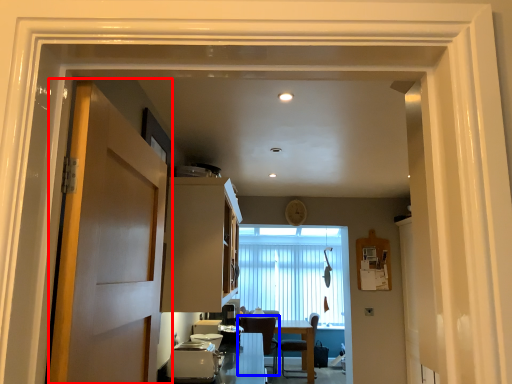
Question: Among these objects, which one is farthest to the camera, door (highlighted by a red box) or chair (highlighted by a blue box)?

Choices:
 (A) door
 (B) chair

Answer: (B)